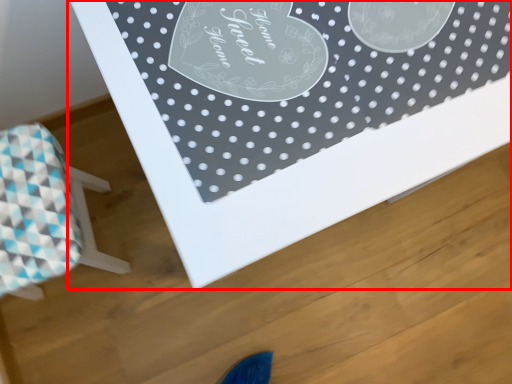
Question: Observing the image, what is the correct spatial positioning of table (annotated by the red box) in reference to furniture?

Choices:
 (A) left
 (B) right

Answer: (B)